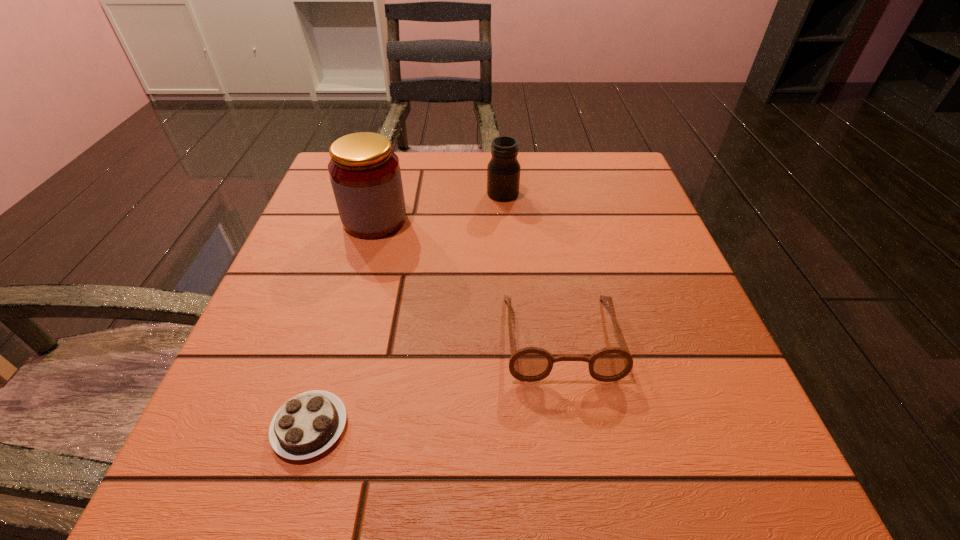
Find the location of `the taller jar`. the taller jar is located at coordinates (365, 175).

Where is `the left jar`? The width and height of the screenshot is (960, 540). the left jar is located at coordinates (365, 175).

Locate an element on the screen. This screenshot has height=540, width=960. the shorter jar is located at coordinates (503, 171).

Locate an element on the screen. The image size is (960, 540). the second tallest object is located at coordinates (503, 171).

At what (x,y) coordinates should I click in order to perform the action: click on the third farthest object. Please return your answer as a coordinate pair (x, y). This screenshot has height=540, width=960. Looking at the image, I should click on (530, 364).

Identify the location of spectacles. This screenshot has height=540, width=960. (530, 364).

Image resolution: width=960 pixels, height=540 pixels. I want to click on chocolate cake, so click(x=308, y=424).

The height and width of the screenshot is (540, 960). Identify the location of the shortest object. (308, 424).

At what (x,y) coordinates should I click in order to perform the action: click on free region located on the back of the left jar. Please return your answer as a coordinate pair (x, y). The image size is (960, 540). Looking at the image, I should click on [391, 163].

Where is `free spot located 0.290m on the front of the shorter jar`? This screenshot has width=960, height=540. free spot located 0.290m on the front of the shorter jar is located at coordinates (510, 299).